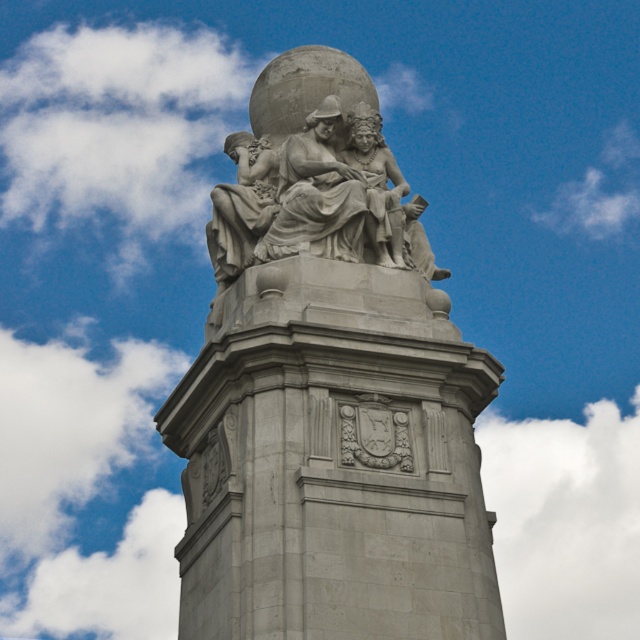
Question: Which point is closer to the camera taking this photo?

Choices:
 (A) (29, 401)
 (B) (445, 371)

Answer: (B)

Question: Estimate the real-world distances between objects in this image. Which object is farther from the white fluffy cloud at upper left?

Choices:
 (A) white fluffy cloud at upper right
 (B) gray stone statue at center

Answer: (B)

Question: Considering the relative positions of gray stone statue at center and white fluffy cloud at upper left in the image provided, where is gray stone statue at center located with respect to white fluffy cloud at upper left?

Choices:
 (A) left
 (B) right

Answer: (B)

Question: Can you confirm if white fluffy cloud at upper right is positioned below white fluffy cloud at upper left?

Choices:
 (A) yes
 (B) no

Answer: (A)

Question: Can you confirm if gray stone statue at center is bigger than white fluffy cloud at upper right?

Choices:
 (A) no
 (B) yes

Answer: (A)

Question: Based on their relative distances, which object is nearer to the gray stone statue at center?

Choices:
 (A) white fluffy cloud at upper left
 (B) white fluffy cloud at upper right

Answer: (B)